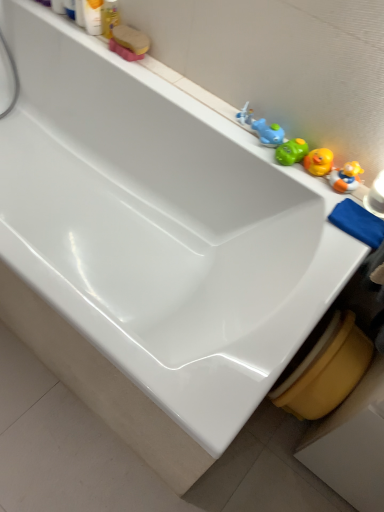
Find the location of `blue cloth at right`. blue cloth at right is located at coordinates (358, 223).

This screenshot has height=512, width=384. What do you see at coordinates (326, 370) in the screenshot? I see `yellow matte plastic toilet bowl at lower right` at bounding box center [326, 370].

Measure the distance between point (139, 46) and camera.

They are 1.36 meters apart.

Image resolution: width=384 pixels, height=512 pixels. What do you see at coordinates (129, 42) in the screenshot? I see `rubber sponge at upper left, which is the 4th toy from right to left` at bounding box center [129, 42].

What do you see at coordinates (109, 17) in the screenshot? I see `matte plastic soap at upper left, the second toiletry from the left` at bounding box center [109, 17].

This screenshot has width=384, height=512. What do you see at coordinates (245, 115) in the screenshot? I see `white plastic toy at upper right, arranged as the 3th toy when viewed from the right` at bounding box center [245, 115].

Locate an element on the screen. The width and height of the screenshot is (384, 512). matte plastic bottle at upper left, which ranks as the 2th toiletry in right-to-left order is located at coordinates (92, 16).

Relative to white plastic toy at upper right, the third toy when ordered from bottom to top, is green rubber duck at upper right, placed as the 1th toy when sorted from bottom to top, in front or behind?

green rubber duck at upper right, placed as the 1th toy when sorted from bottom to top, is positioned closer to the viewer than white plastic toy at upper right, the third toy when ordered from bottom to top.

Considering the relative sizes of green rubber duck at upper right, which is the fourth toy from top to bottom, and white plastic toy at upper right, marked as the 2th toy in a top-to-bottom arrangement, in the image provided, is green rubber duck at upper right, which is the fourth toy from top to bottom, shorter than white plastic toy at upper right, marked as the 2th toy in a top-to-bottom arrangement,?

No, green rubber duck at upper right, which is the fourth toy from top to bottom, is not shorter than white plastic toy at upper right, marked as the 2th toy in a top-to-bottom arrangement.

The height and width of the screenshot is (512, 384). Find the location of `the 2nd toy in front of the white plastic toy at upper right, marked as the 2th toy in a top-to-bottom arrangement, starting your count from the anchor`. the 2nd toy in front of the white plastic toy at upper right, marked as the 2th toy in a top-to-bottom arrangement, starting your count from the anchor is located at coordinates (291, 151).

Is green rubber duck at upper right, the first toy viewed from the right, spatially inside white plastic toy at upper right, arranged as the 3th toy when viewed from the right, or outside of it?

The correct answer is: outside.

Does rubber sponge at upper left, placed as the 1th toy when sorted from left to right, have a lesser height compared to blue rubber duck at upper right, placed as the 2th toy when sorted from bottom to top?

Yes.

Is blue rubber duck at upper right, placed as the 2th toy when sorted from bottom to top, located within rubber sponge at upper left, which is the first toy in top-to-bottom order?

That's incorrect, blue rubber duck at upper right, placed as the 2th toy when sorted from bottom to top, is not inside rubber sponge at upper left, which is the first toy in top-to-bottom order.

Is rubber sponge at upper left, which is the 4th toy from right to left, looking in the opposite direction of blue rubber duck at upper right, which appears as the 3th toy when viewed from the top?

No, rubber sponge at upper left, which is the 4th toy from right to left, is not facing away from blue rubber duck at upper right, which appears as the 3th toy when viewed from the top.

Does rubber sponge at upper left, which is the first toy in top-to-bottom order, lie behind blue rubber duck at upper right, placed as the 2th toy when sorted from bottom to top?

That is True.

Is rubber sponge at upper left, placed as the fourth toy when sorted from bottom to top, next to matte plastic soap at upper left, the second toiletry from the left?

Yes, rubber sponge at upper left, placed as the fourth toy when sorted from bottom to top, is with matte plastic soap at upper left, the second toiletry from the left.

From a real-world perspective, is rubber sponge at upper left, placed as the 1th toy when sorted from left to right, physically below matte plastic soap at upper left, which is counted as the 1th toiletry, starting from the right?

Correct, in the physical world, rubber sponge at upper left, placed as the 1th toy when sorted from left to right, is lower than matte plastic soap at upper left, which is counted as the 1th toiletry, starting from the right.

Is white plastic toy at upper right, marked as the 2th toy in a top-to-bottom arrangement, oriented towards yellow matte plastic toilet bowl at lower right?

No, white plastic toy at upper right, marked as the 2th toy in a top-to-bottom arrangement, is not oriented towards yellow matte plastic toilet bowl at lower right.

Between white plastic toy at upper right, the third toy when ordered from bottom to top, and yellow matte plastic toilet bowl at lower right, which one has less height?

With less height is white plastic toy at upper right, the third toy when ordered from bottom to top.

Does point (252, 112) appear closer or farther from the camera than point (339, 400)?

Point (252, 112) is farther from the camera than point (339, 400).

Is white plastic toy at upper right, marked as the 2th toy in a top-to-bottom arrangement, not near yellow matte plastic toilet bowl at lower right?

No.

Is point (325, 348) behind point (368, 216)?

Yes.

Looking at this image, is yellow matte plastic toilet bowl at lower right looking in the opposite direction of blue cloth at right?

No, yellow matte plastic toilet bowl at lower right is not facing the opposite direction of blue cloth at right.

Looking at their sizes, would you say yellow matte plastic toilet bowl at lower right is wider or thinner than blue cloth at right?

→ yellow matte plastic toilet bowl at lower right is wider than blue cloth at right.

The image size is (384, 512). Find the location of `toilet bowl to the left of blue cloth at right`. toilet bowl to the left of blue cloth at right is located at coordinates tap(326, 370).

Is matte plastic soap at upper left, which is counted as the 1th toiletry, starting from the right, situated inside white plastic toy at upper right, arranged as the 3th toy when viewed from the right, or outside?

matte plastic soap at upper left, which is counted as the 1th toiletry, starting from the right, is outside white plastic toy at upper right, arranged as the 3th toy when viewed from the right.

Would you say matte plastic soap at upper left, which is counted as the 1th toiletry, starting from the right, is to the left or to the right of white plastic toy at upper right, marked as the 2th toy in a top-to-bottom arrangement, in the picture?

From the image, it's evident that matte plastic soap at upper left, which is counted as the 1th toiletry, starting from the right, is to the left of white plastic toy at upper right, marked as the 2th toy in a top-to-bottom arrangement.

Can you confirm if matte plastic soap at upper left, the second toiletry from the left, is bigger than white plastic toy at upper right, marked as the 2th toy in a top-to-bottom arrangement?

Yes, matte plastic soap at upper left, the second toiletry from the left, is bigger than white plastic toy at upper right, marked as the 2th toy in a top-to-bottom arrangement.

Can you confirm if matte plastic soap at upper left, the second toiletry from the left, is thinner than white plastic toy at upper right, the second toy in the left-to-right sequence?

No.

Is white plastic toy at upper right, the third toy when ordered from bottom to top, to the left of green rubber duck at upper right, which is the fourth toy from top to bottom, from the viewer's perspective?

Yes.

What's the angular difference between white plastic toy at upper right, the third toy when ordered from bottom to top, and green rubber duck at upper right, placed as the 1th toy when sorted from bottom to top,'s facing directions?

The angular difference between white plastic toy at upper right, the third toy when ordered from bottom to top, and green rubber duck at upper right, placed as the 1th toy when sorted from bottom to top, is 0.000133 degrees.

Do you think white plastic toy at upper right, marked as the 2th toy in a top-to-bottom arrangement, is within green rubber duck at upper right, which is the 4th toy in left-to-right order, or outside of it?

white plastic toy at upper right, marked as the 2th toy in a top-to-bottom arrangement, lies outside green rubber duck at upper right, which is the 4th toy in left-to-right order.

Who is bigger, white plastic toy at upper right, the third toy when ordered from bottom to top, or green rubber duck at upper right, placed as the 1th toy when sorted from bottom to top?

With larger size is green rubber duck at upper right, placed as the 1th toy when sorted from bottom to top.

This screenshot has height=512, width=384. Identify the location of the 2nd toy to the left when counting from the green rubber duck at upper right, which is the 4th toy in left-to-right order. 245,115.

Identify the location of toy that is the 2nd one when counting upward from the blue rubber duck at upper right, placed as the 2th toy when sorted from bottom to top (from the image's perspective). The width and height of the screenshot is (384, 512). (129, 42).

Which object lies further to the anchor point matte plastic soap at upper left, the second toiletry from the left, matte plastic bottle at upper left, which ranks as the 2th toiletry in right-to-left order, or green rubber duck at upper right, placed as the 1th toy when sorted from bottom to top?

green rubber duck at upper right, placed as the 1th toy when sorted from bottom to top, is positioned further to the anchor matte plastic soap at upper left, the second toiletry from the left.

When comparing their distances from blue rubber duck at upper right, the second toy from the right, does white plastic toy at upper right, arranged as the 3th toy when viewed from the right, or matte plastic soap at upper left, which is counted as the 1th toiletry, starting from the right, seem closer?

white plastic toy at upper right, arranged as the 3th toy when viewed from the right, lies closer to blue rubber duck at upper right, the second toy from the right, than the other object.

Considering their positions, is matte plastic soap at upper left, the second toiletry from the left, positioned further to blue cloth at right than yellow matte plastic toilet bowl at lower right?

matte plastic soap at upper left, the second toiletry from the left.

From the image, which object appears to be farther from blue rubber duck at upper right, which ranks as the third toy in left-to-right order, yellow matte plastic toilet bowl at lower right or white plastic toy at upper right, the second toy in the left-to-right sequence?

yellow matte plastic toilet bowl at lower right is positioned further to the anchor blue rubber duck at upper right, which ranks as the third toy in left-to-right order.

Looking at the image, which one is located closer to rubber sponge at upper left, placed as the fourth toy when sorted from bottom to top, white plastic toy at upper right, marked as the 2th toy in a top-to-bottom arrangement, or green rubber duck at upper right, which is the fourth toy from top to bottom?

Among the two, white plastic toy at upper right, marked as the 2th toy in a top-to-bottom arrangement, is located nearer to rubber sponge at upper left, placed as the fourth toy when sorted from bottom to top.

Based on their spatial positions, is blue rubber duck at upper right, placed as the 2th toy when sorted from bottom to top, or matte plastic bottle at upper left, arranged as the first toiletry when viewed from the left, closer to matte plastic soap at upper left, which is counted as the 1th toiletry, starting from the right?

Based on the image, matte plastic bottle at upper left, arranged as the first toiletry when viewed from the left, appears to be nearer to matte plastic soap at upper left, which is counted as the 1th toiletry, starting from the right.

From the image, which object appears to be farther from matte plastic bottle at upper left, which ranks as the 2th toiletry in right-to-left order, yellow matte plastic toilet bowl at lower right or white plastic toy at upper right, the third toy when ordered from bottom to top?

The object further to matte plastic bottle at upper left, which ranks as the 2th toiletry in right-to-left order, is yellow matte plastic toilet bowl at lower right.

Looking at the image, which one is located further to green rubber duck at upper right, which is the 4th toy in left-to-right order, yellow matte plastic toilet bowl at lower right or rubber sponge at upper left, placed as the 1th toy when sorted from left to right?

rubber sponge at upper left, placed as the 1th toy when sorted from left to right, is positioned further to the anchor green rubber duck at upper right, which is the 4th toy in left-to-right order.

Image resolution: width=384 pixels, height=512 pixels. Find the location of `toy located between matte plastic soap at upper left, which is counted as the 1th toiletry, starting from the right, and white plastic toy at upper right, arranged as the 3th toy when viewed from the right, in the left-right direction`. toy located between matte plastic soap at upper left, which is counted as the 1th toiletry, starting from the right, and white plastic toy at upper right, arranged as the 3th toy when viewed from the right, in the left-right direction is located at coordinates (129, 42).

Locate an element on the screen. This screenshot has width=384, height=512. bath towel between green rubber duck at upper right, the first toy viewed from the right, and yellow matte plastic toilet bowl at lower right vertically is located at coordinates (358, 223).

Locate an element on the screen. toy that lies between white plastic toy at upper right, arranged as the 3th toy when viewed from the right, and green rubber duck at upper right, the first toy viewed from the right, from top to bottom is located at coordinates (261, 127).

Image resolution: width=384 pixels, height=512 pixels. Identify the location of toiletry between matte plastic bottle at upper left, arranged as the first toiletry when viewed from the left, and blue cloth at right vertically. (109, 17).